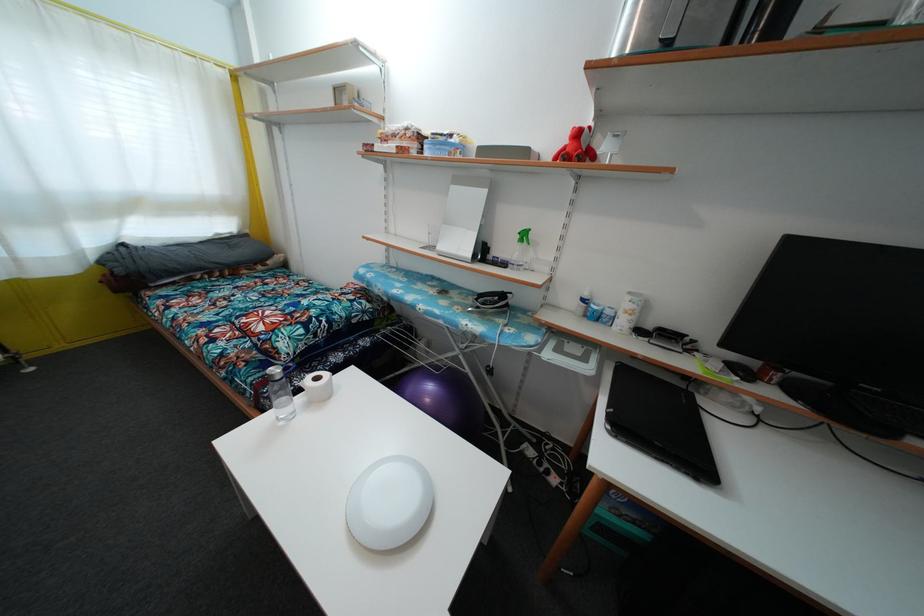
Where is `clear water bottle`? This screenshot has width=924, height=616. clear water bottle is located at coordinates (280, 394).